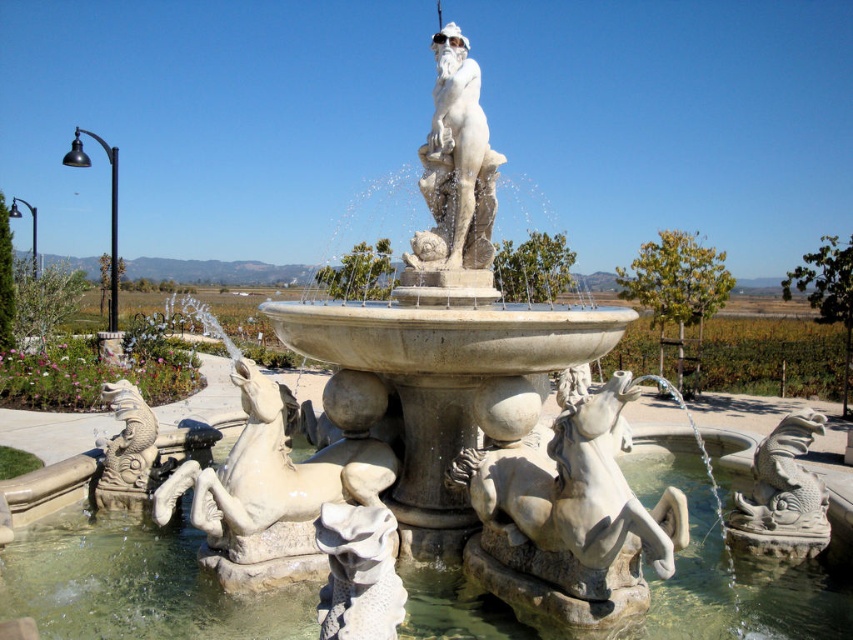
What do you see at coordinates (289, 460) in the screenshot?
I see `white marble horse at center` at bounding box center [289, 460].

Between point (212, 540) and point (439, 92), which one is positioned in front?

Point (212, 540)

The height and width of the screenshot is (640, 853). What do you see at coordinates (289, 460) in the screenshot?
I see `white marble horse at center` at bounding box center [289, 460].

This screenshot has width=853, height=640. I want to click on white marble horse at center, so click(289, 460).

What do you see at coordinates (289, 460) in the screenshot?
I see `white marble horse at center` at bounding box center [289, 460].

Between white marble horse at center and gray stone dragon at lower right, which one is positioned higher?

Positioned higher is white marble horse at center.

Who is more forward, (218, 524) or (755, 552)?

Point (218, 524)

At what (x,y) coordinates should I click in order to perform the action: click on white marble horse at center. Please return your answer as a coordinate pair (x, y). This screenshot has width=853, height=640. Looking at the image, I should click on (289, 460).

From the picture: Is white marble statue at center shorter than gray stone dragon at lower right?

Incorrect, white marble statue at center's height does not fall short of gray stone dragon at lower right's.

Can you confirm if white marble statue at center is taller than gray stone dragon at lower right?

Correct, white marble statue at center is much taller as gray stone dragon at lower right.

Who is more forward, [498,156] or [753,515]?

Positioned in front is point [753,515].

The height and width of the screenshot is (640, 853). What are the coordinates of `white marble statue at center` in the screenshot? It's located at (456, 164).